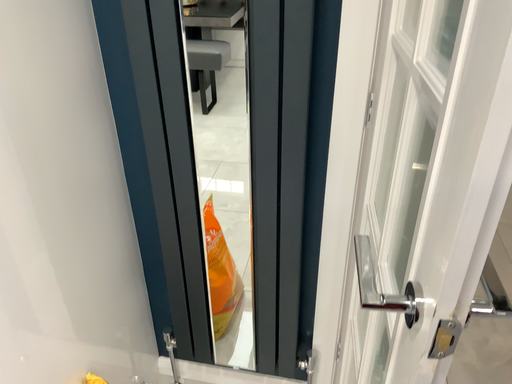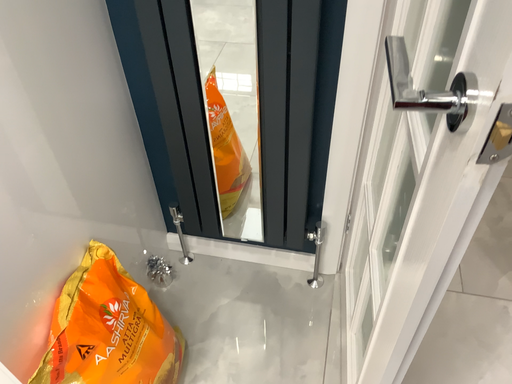
Question: How did the camera likely rotate when shooting the video?

Choices:
 (A) rotated upward
 (B) rotated downward

Answer: (B)